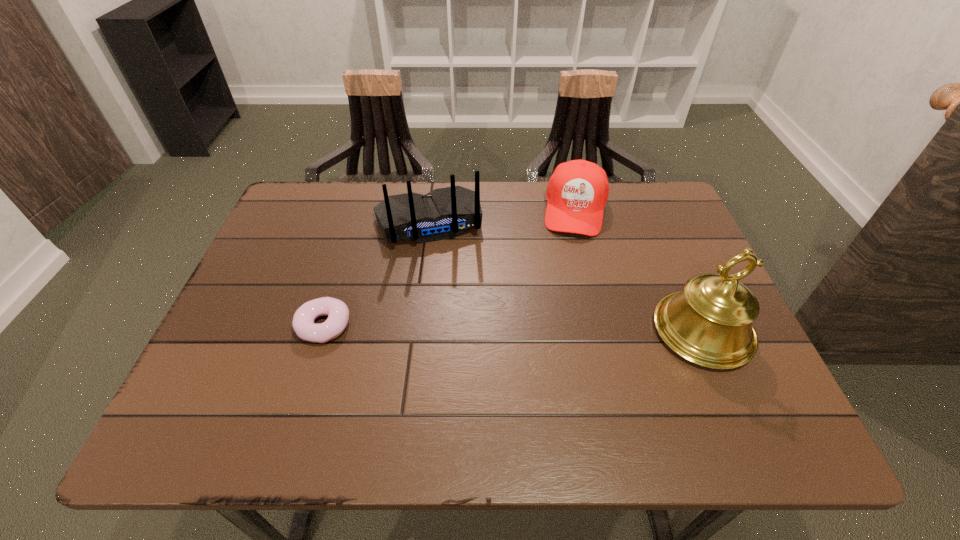
Locate an element on the screen. vacant space on the desktop that is between the shortest object and the tallest object and is positioned on the back of the second tallest object is located at coordinates (457, 327).

Where is `free spot on the desktop that is between the doughnut and the rightmost object and is positioned on the front panel of the third object from left to right`? free spot on the desktop that is between the doughnut and the rightmost object and is positioned on the front panel of the third object from left to right is located at coordinates (560, 329).